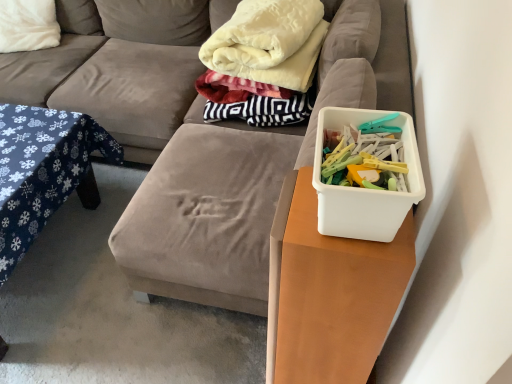
Measure the distance between point (329, 199) and camera.

Point (329, 199) is 28.66 inches from camera.

What is the approximate width of velvety white blanket at upper center?

23.53 inches.

Consider the image. Measure the distance between velvet fabric couch at center and camera.

velvet fabric couch at center and camera are 1.37 meters apart from each other.

Image resolution: width=512 pixels, height=384 pixels. I want to click on blue fabric table at left, so click(x=50, y=178).

Locate an element on the screen. white soft pillow at upper left is located at coordinates [28, 25].

How much distance is there between white plastic container at right and velvet fabric couch at center?

The distance of white plastic container at right from velvet fabric couch at center is 3.57 feet.

From a real-world perspective, is white plastic container at right physically located above or below velvet fabric couch at center?

From a real-world perspective, white plastic container at right is physically above velvet fabric couch at center.

Considering the sizes of objects white plastic container at right and velvet fabric couch at center in the image provided, who is taller, white plastic container at right or velvet fabric couch at center?

velvet fabric couch at center is taller.

Is white soft pillow at upper left with velvety white blanket at upper center?

No, white soft pillow at upper left is not touching velvety white blanket at upper center.

From a real-world perspective, which is physically above, white soft pillow at upper left or velvety white blanket at upper center?

velvety white blanket at upper center is physically above.

Is white soft pillow at upper left at the left side of velvety white blanket at upper center?

Correct, you'll find white soft pillow at upper left to the left of velvety white blanket at upper center.

Based on the photo, from the image's perspective, relative to velvety white blanket at upper center, is white soft pillow at upper left above or below?

Based on their image positions, white soft pillow at upper left is located above velvety white blanket at upper center.

Is the surface of white soft pillow at upper left in direct contact with blue fabric table at left?

white soft pillow at upper left and blue fabric table at left are not in contact.

Between white soft pillow at upper left and blue fabric table at left, which one appears on the left side from the viewer's perspective?

white soft pillow at upper left is more to the left.

Does point (3, 44) appear closer or farther from the camera than point (41, 180)?

Point (3, 44) is positioned farther from the camera compared to point (41, 180).

Which is in front, white soft pillow at upper left or blue fabric table at left?

blue fabric table at left is more forward.

Is point (405, 208) positioned behind point (30, 8)?

No, (405, 208) is closer to viewer.

In the image, is white plastic container at right positioned in front of or behind white soft pillow at upper left?

Visually, white plastic container at right is located in front of white soft pillow at upper left.

Is white plastic container at right located outside white soft pillow at upper left?

Yes, white plastic container at right is located beyond the bounds of white soft pillow at upper left.

In the image, is white plastic container at right on the left side or the right side of white soft pillow at upper left?

white plastic container at right is positioned on white soft pillow at upper left's right side.

Which is further, [66,177] or [215,35]?

The point [66,177] is behind.

Can you confirm if blue fabric table at left is smaller than velvety white blanket at upper center?

Incorrect, blue fabric table at left is not smaller in size than velvety white blanket at upper center.

Between blue fabric table at left and velvety white blanket at upper center, which one has less height?

With less height is blue fabric table at left.

Are white plastic container at right and velvety white blanket at upper center far apart?

No, white plastic container at right is in close proximity to velvety white blanket at upper center.

Considering the relative sizes of white plastic container at right and velvety white blanket at upper center in the image provided, is white plastic container at right wider than velvety white blanket at upper center?

In fact, white plastic container at right might be narrower than velvety white blanket at upper center.

From the image's perspective, is white plastic container at right located beneath velvety white blanket at upper center?

Indeed, from the image's perspective, white plastic container at right is shown beneath velvety white blanket at upper center.

Is white plastic container at right closer to the viewer compared to velvety white blanket at upper center?

Yes, white plastic container at right is closer to the viewer.

Which of these two, velvet fabric couch at center or velvety white blanket at upper center, stands shorter?

velvety white blanket at upper center.

In the image, is velvet fabric couch at center positioned in front of or behind velvety white blanket at upper center?

velvet fabric couch at center is in front of velvety white blanket at upper center.

From the image's perspective, which is below, velvet fabric couch at center or velvety white blanket at upper center?

From the image's view, velvet fabric couch at center is below.

Is velvet fabric couch at center in contact with velvety white blanket at upper center?

No, velvet fabric couch at center is not in contact with velvety white blanket at upper center.

This screenshot has height=384, width=512. What are the coordinates of `studio couch below the white plastic container at right (from a real-world perspective)` in the screenshot? It's located at (170, 149).

Locate an element on the screen. The width and height of the screenshot is (512, 384). blanket on the right of white soft pillow at upper left is located at coordinates (269, 42).

Estimate the real-world distances between objects in this image. Which object is closer to velvet fabric couch at center, white soft pillow at upper left or velvety white blanket at upper center?

The object closer to velvet fabric couch at center is velvety white blanket at upper center.

Estimate the real-world distances between objects in this image. Which object is closer to velvet fabric couch at center, blue fabric table at left or white plastic container at right?

blue fabric table at left.

When comparing their distances from velvety white blanket at upper center, does white plastic container at right or white soft pillow at upper left seem further?

white soft pillow at upper left.

Considering their positions, is velvet fabric couch at center positioned closer to blue fabric table at left than white soft pillow at upper left?

Among the two, velvet fabric couch at center is located nearer to blue fabric table at left.

Estimate the real-world distances between objects in this image. Which object is closer to white plastic container at right, white soft pillow at upper left or blue fabric table at left?

blue fabric table at left lies closer to white plastic container at right than the other object.

Based on their spatial positions, is white plastic container at right or velvety white blanket at upper center closer to blue fabric table at left?

velvety white blanket at upper center is closer to blue fabric table at left.

Based on their spatial positions, is velvet fabric couch at center or white plastic container at right further from blue fabric table at left?

The object further to blue fabric table at left is white plastic container at right.

Based on their spatial positions, is white soft pillow at upper left or velvet fabric couch at center closer to blue fabric table at left?

velvet fabric couch at center is closer to blue fabric table at left.

This screenshot has height=384, width=512. Find the location of `studio couch between blue fabric table at left and white plastic container at right in the horizontal direction`. studio couch between blue fabric table at left and white plastic container at right in the horizontal direction is located at coordinates (170, 149).

Where is `studio couch between blue fabric table at left and velvety white blanket at upper center`? The height and width of the screenshot is (384, 512). studio couch between blue fabric table at left and velvety white blanket at upper center is located at coordinates (170, 149).

Find the location of a particular element. The height and width of the screenshot is (384, 512). blanket between blue fabric table at left and white plastic container at right from left to right is located at coordinates (269, 42).

Where is `studio couch positioned between white plastic container at right and white soft pillow at upper left from near to far`? studio couch positioned between white plastic container at right and white soft pillow at upper left from near to far is located at coordinates (170, 149).